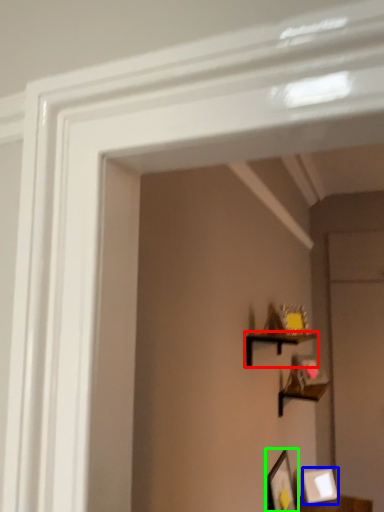
Question: Which is nearer to the shelf (highlighted by a red box)? picture frame (highlighted by a blue box) or picture frame (highlighted by a green box).

Choices:
 (A) picture frame
 (B) picture frame

Answer: (B)